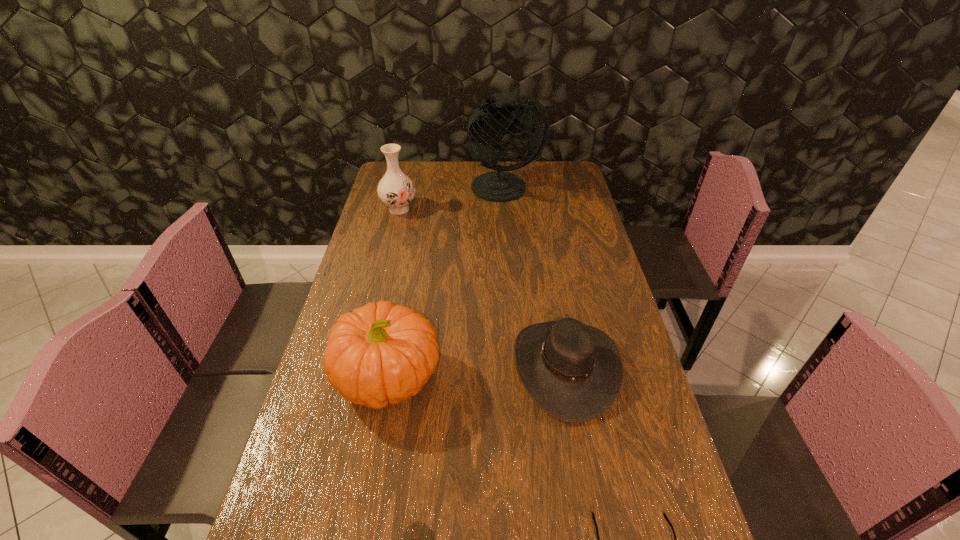
The height and width of the screenshot is (540, 960). In order to click on object that is at the far edge in this screenshot , I will do `click(489, 119)`.

The image size is (960, 540). I want to click on vase that is at the left edge, so click(x=396, y=190).

Image resolution: width=960 pixels, height=540 pixels. In order to click on pumpkin positioned at the left edge in this screenshot , I will do `click(381, 353)`.

Where is `globe that is positioned at the right edge`? This screenshot has width=960, height=540. globe that is positioned at the right edge is located at coordinates click(489, 119).

You are a GUI agent. You are given a task and a screenshot of the screen. Output one action in this format:
    pyautogui.click(x=<x>, y=<y>)
    Task: Click on the cowboy hat that is positioned at the right edge
    This screenshot has width=960, height=540.
    Given the screenshot: What is the action you would take?
    pyautogui.click(x=574, y=372)

The image size is (960, 540). In order to click on object that is at the far right corner in this screenshot , I will do `click(489, 119)`.

Find the location of a particular element. This screenshot has height=540, width=960. vacant space at the left edge is located at coordinates (357, 291).

The height and width of the screenshot is (540, 960). Identify the location of free space at the right edge of the desktop. (628, 343).

Find the location of a particular element. empty space that is in between the tallest object and the pumpkin is located at coordinates (448, 282).

The height and width of the screenshot is (540, 960). In order to click on free space between the pumpkin and the cowboy hat in this screenshot , I will do `click(478, 373)`.